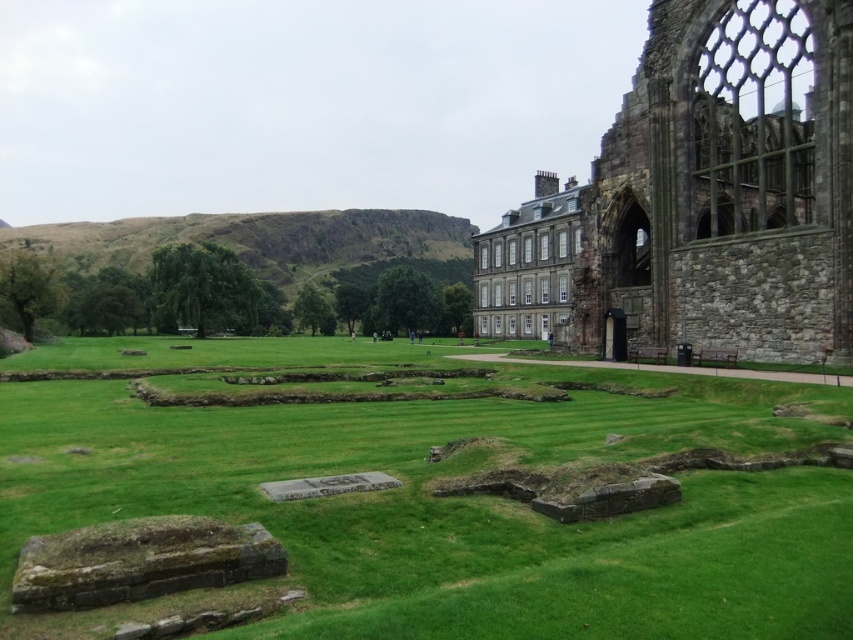
Who is more distant from viewer, (78, 460) or (592, 252)?

Point (592, 252)

Which is more to the left, green grass at center or stone wall at right?

green grass at center

Between point (666, 436) and point (654, 163), which one is positioned behind?

Positioned behind is point (654, 163).

Where is `green grass at center`? The image size is (853, 640). green grass at center is located at coordinates (456, 508).